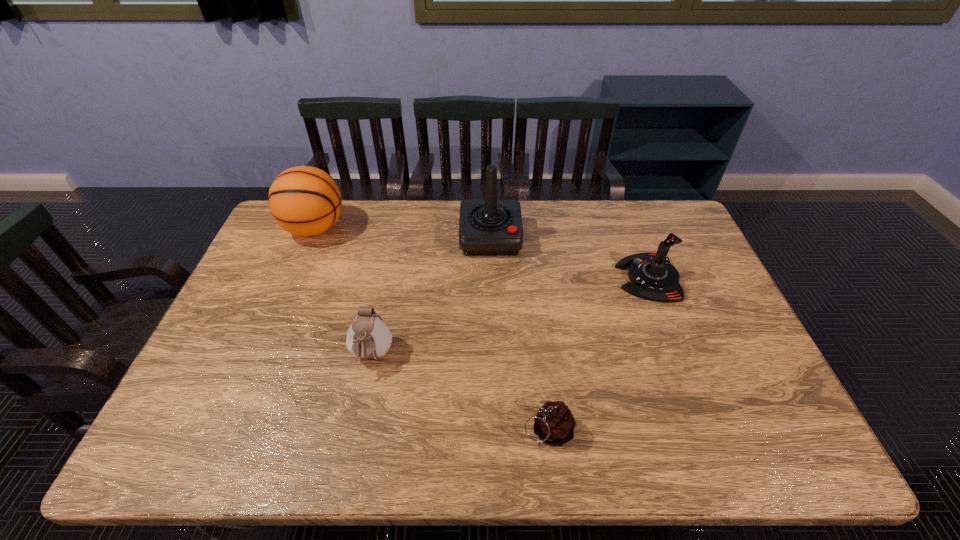
I want to click on the second closest object to the rightmost object, so click(x=554, y=424).

Locate an element on the screen. Image resolution: width=960 pixels, height=540 pixels. blank space that satisfies the following two spatial constraints: 1. on the handle side of the right joystick; 2. on the front-facing side of the pouch is located at coordinates (678, 356).

Where is `vacant space that satisfies the following two spatial constraints: 1. on the handle side of the shorter joystick; 2. on the front-facing side of the fourth farthest object`? The width and height of the screenshot is (960, 540). vacant space that satisfies the following two spatial constraints: 1. on the handle side of the shorter joystick; 2. on the front-facing side of the fourth farthest object is located at coordinates (678, 356).